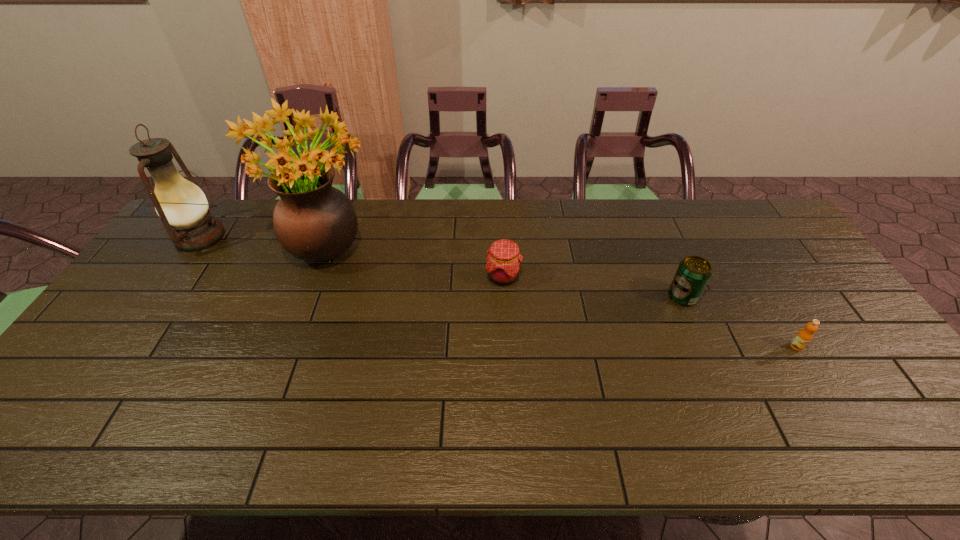
You are a GUI agent. You are given a task and a screenshot of the screen. Output one action in this format:
    pyautogui.click(x=<x>, y=<y>)
    Task: Click on the vacant space located on the front label of the rightmost object
    
    Given the screenshot: What is the action you would take?
    pyautogui.click(x=860, y=450)

The height and width of the screenshot is (540, 960). Find the location of `flower arrangement located in the far edge section of the desktop`. flower arrangement located in the far edge section of the desktop is located at coordinates (313, 221).

This screenshot has width=960, height=540. Find the location of `oil lamp at the far edge`. oil lamp at the far edge is located at coordinates (182, 206).

You are a GUI agent. You are given a task and a screenshot of the screen. Output one action in this format:
    pyautogui.click(x=<x>, y=<y>)
    Task: Click on the object positioned at the left edge
    The width and height of the screenshot is (960, 540).
    Given the screenshot: What is the action you would take?
    pyautogui.click(x=182, y=206)

Locate an element on the screen. This screenshot has height=540, width=960. object at the far left corner is located at coordinates (182, 206).

Where is `vacant space at the far edge of the desktop`? vacant space at the far edge of the desktop is located at coordinates (710, 233).

The height and width of the screenshot is (540, 960). What are the coordinates of `free location at the near edge` in the screenshot? It's located at (163, 431).

The image size is (960, 540). I want to click on vacant space at the left edge of the desktop, so click(x=168, y=253).

Where is `vacant point at the right edge`? Image resolution: width=960 pixels, height=540 pixels. vacant point at the right edge is located at coordinates (762, 255).

This screenshot has width=960, height=540. In the image, there is a desktop. Find the location of `vacant space at the near right corner`. vacant space at the near right corner is located at coordinates (888, 428).